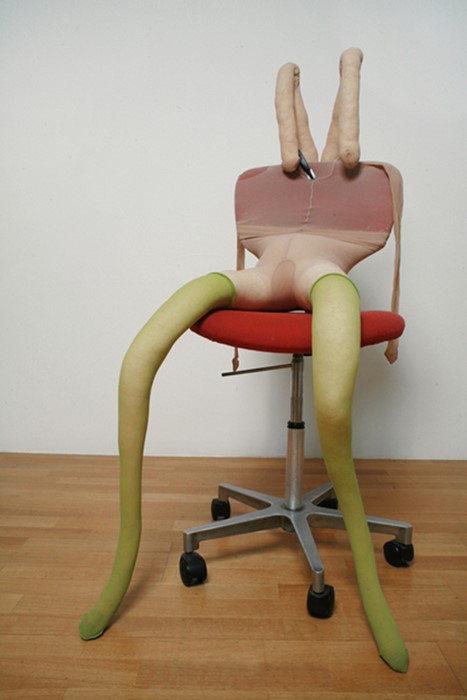
Where is `shadow of chair`? This screenshot has width=467, height=700. shadow of chair is located at coordinates (264, 547).